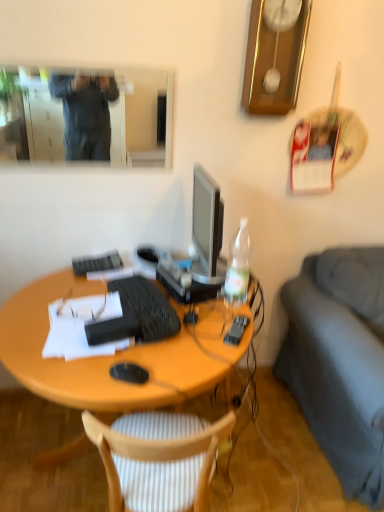
What are the coordinates of `vacant space in front of clear plastic bottle at right` in the screenshot? It's located at (225, 315).